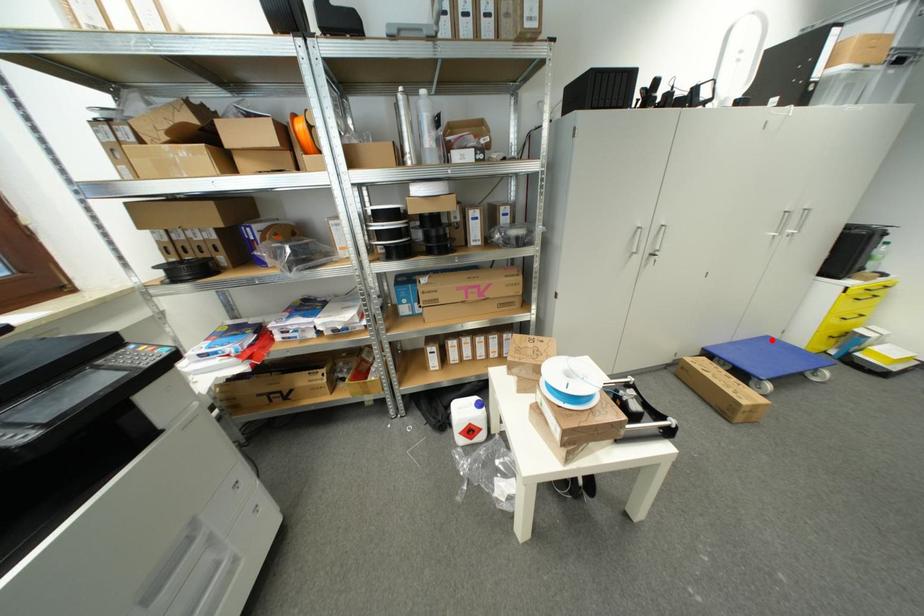
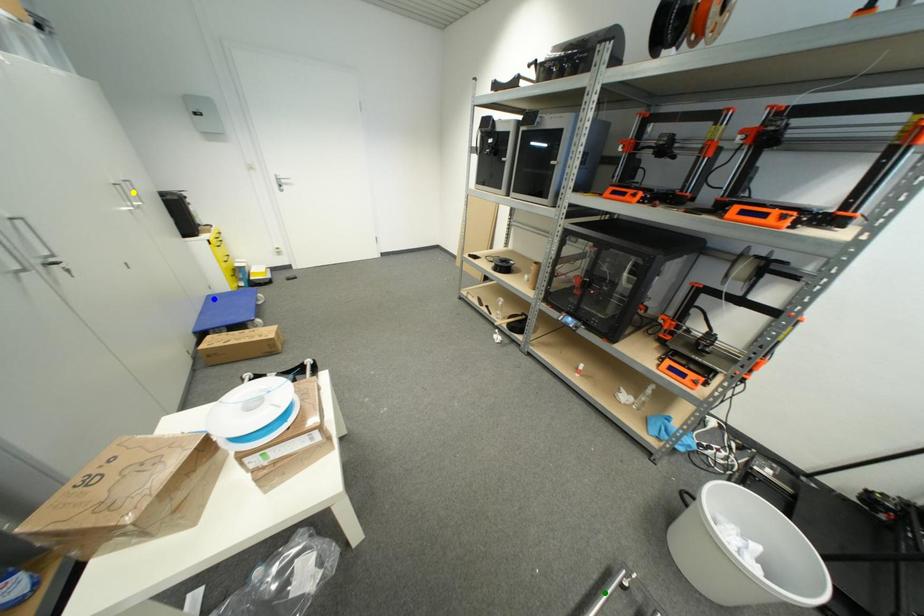
Question: I am providing you with two images of the same scene from different viewpoints. A red point is marked on the first image. You are given multiple points on the second image. In image 2, which mark is for the same physical point as the one in image 1?

Choices:
 (A) blue point
 (B) green point
 (C) yellow point

Answer: (A)